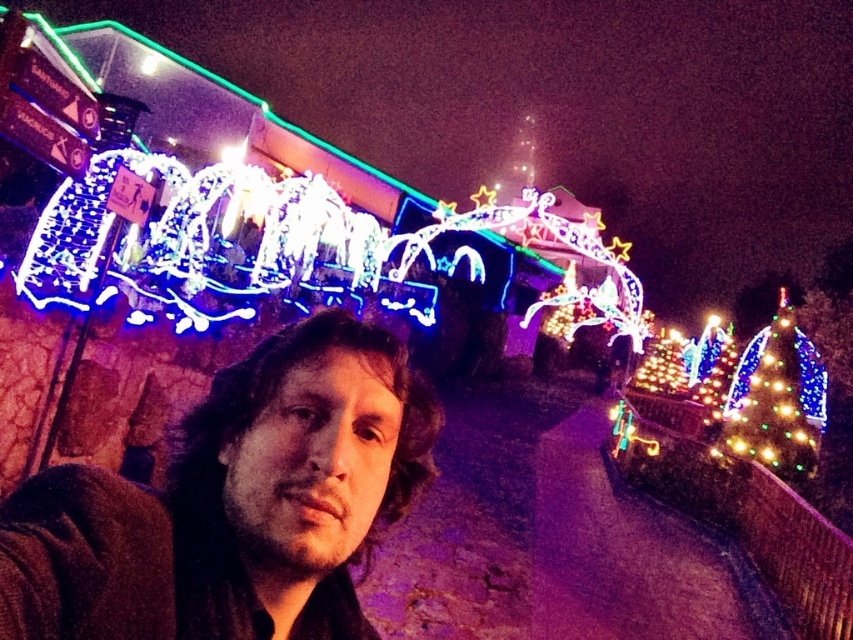
In the festive nighttime scene, there is a person with curly hair wearing a dark jacket at the center and a small Christmas tree to the right. If you were standing at the point marked by coordinates (233, 502), which object would you be closest to?

The point marked by coordinates (233, 502) is closest to the matte black jacket at center, as it is explicitly marked there.

You are a photographer trying to capture the festive scene. You notice the matte black jacket at center and the multicolored lights at right in your viewfinder. Which object appears larger in the photo?

The multicolored lights at right appear larger in the photo because they are bigger than the matte black jacket at center.

Based on the photo, you are a photographer trying to capture the festive scene. You want to ensure the matte black jacket at center is centered in your photo. Given the jacket is at coordinates 0.787 on the x and 0.274 on the y, what adjustments should you make to the camera frame?

The matte black jacket at center is located at coordinates x 0.787 and y 0.274. To center it, adjust the camera frame so the jacket moves to the center point of the image, which is typically at x 0.5 and y 0.5. This would require shifting the frame slightly to the left and upward.